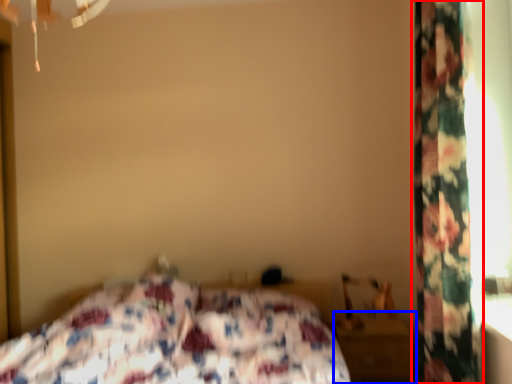
Question: Which object is further to the camera taking this photo, curtain (highlighted by a red box) or nightstand (highlighted by a blue box)?

Choices:
 (A) curtain
 (B) nightstand

Answer: (B)